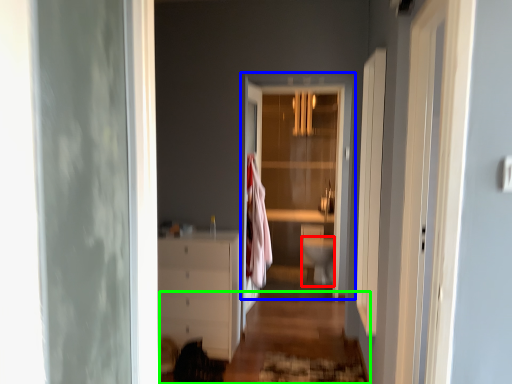
Question: Which object is the farthest from toilet bowl (highlighted by a red box)? Choose among these: door (highlighted by a blue box) or path (highlighted by a green box).

Choices:
 (A) door
 (B) path

Answer: (A)